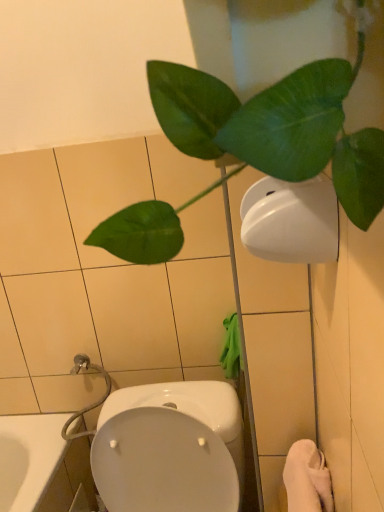
Question: Should I look upward or downward to see white glossy toilet at lower center?

Choices:
 (A) down
 (B) up

Answer: (A)

Question: Is white glossy toilet at lower center thinner than white matte toilet paper at upper right?

Choices:
 (A) no
 (B) yes

Answer: (A)

Question: Would you say white glossy toilet at lower center contains white matte toilet paper at upper right?

Choices:
 (A) yes
 (B) no

Answer: (B)

Question: Considering the relative sizes of white glossy toilet at lower center and white matte toilet paper at upper right in the image provided, is white glossy toilet at lower center smaller than white matte toilet paper at upper right?

Choices:
 (A) no
 (B) yes

Answer: (A)

Question: Does white glossy toilet at lower center lie in front of white matte toilet paper at upper right?

Choices:
 (A) no
 (B) yes

Answer: (A)

Question: Is white glossy toilet at lower center shorter than white matte toilet paper at upper right?

Choices:
 (A) yes
 (B) no

Answer: (B)

Question: Could you tell me if white glossy toilet at lower center is turned towards white matte toilet paper at upper right?

Choices:
 (A) no
 (B) yes

Answer: (A)

Question: Is green matte leafy plant at upper right taller than white soft towel at lower right?

Choices:
 (A) no
 (B) yes

Answer: (B)

Question: Can you confirm if green matte leafy plant at upper right is shorter than white soft towel at lower right?

Choices:
 (A) yes
 (B) no

Answer: (B)

Question: Considering the relative positions of green matte leafy plant at upper right and white soft towel at lower right in the image provided, is green matte leafy plant at upper right to the left of white soft towel at lower right from the viewer's perspective?

Choices:
 (A) no
 (B) yes

Answer: (B)

Question: Considering the relative sizes of green matte leafy plant at upper right and white soft towel at lower right in the image provided, is green matte leafy plant at upper right smaller than white soft towel at lower right?

Choices:
 (A) yes
 (B) no

Answer: (B)

Question: From the image's perspective, would you say green matte leafy plant at upper right is positioned over white soft towel at lower right?

Choices:
 (A) yes
 (B) no

Answer: (A)

Question: Is green matte leafy plant at upper right facing towards white soft towel at lower right?

Choices:
 (A) yes
 (B) no

Answer: (B)

Question: Can you confirm if white soft towel at lower right is thinner than white glossy toilet at lower center?

Choices:
 (A) no
 (B) yes

Answer: (B)